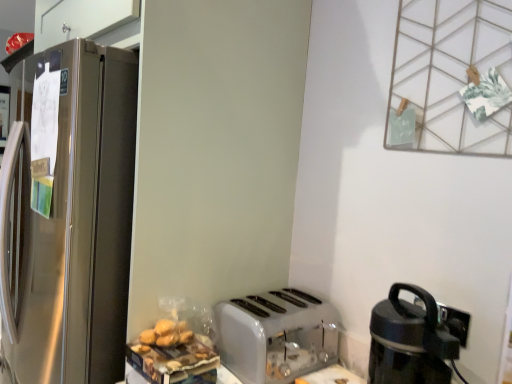
Question: Is white plastic toaster at lower center wider or thinner than black plastic coffee maker at lower right?

Choices:
 (A) thin
 (B) wide

Answer: (B)

Question: Which is correct: white plastic toaster at lower center is inside black plastic coffee maker at lower right, or outside of it?

Choices:
 (A) outside
 (B) inside

Answer: (A)

Question: Is point (281, 291) positioned closer to the camera than point (413, 377)?

Choices:
 (A) closer
 (B) farther

Answer: (B)

Question: In terms of width, does black plastic coffee maker at lower right look wider or thinner when compared to white plastic toaster at lower center?

Choices:
 (A) thin
 (B) wide

Answer: (A)

Question: From their relative heights in the image, would you say black plastic coffee maker at lower right is taller or shorter than white plastic toaster at lower center?

Choices:
 (A) tall
 (B) short

Answer: (A)

Question: Which is correct: black plastic coffee maker at lower right is inside white plastic toaster at lower center, or outside of it?

Choices:
 (A) inside
 (B) outside

Answer: (B)

Question: In the image, is black plastic coffee maker at lower right positioned in front of or behind white plastic toaster at lower center?

Choices:
 (A) behind
 (B) front

Answer: (B)